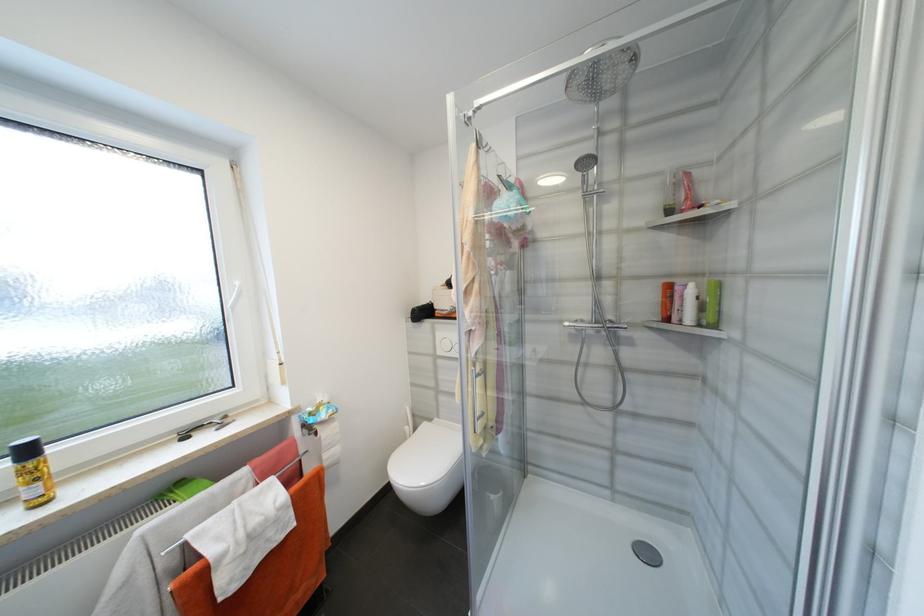
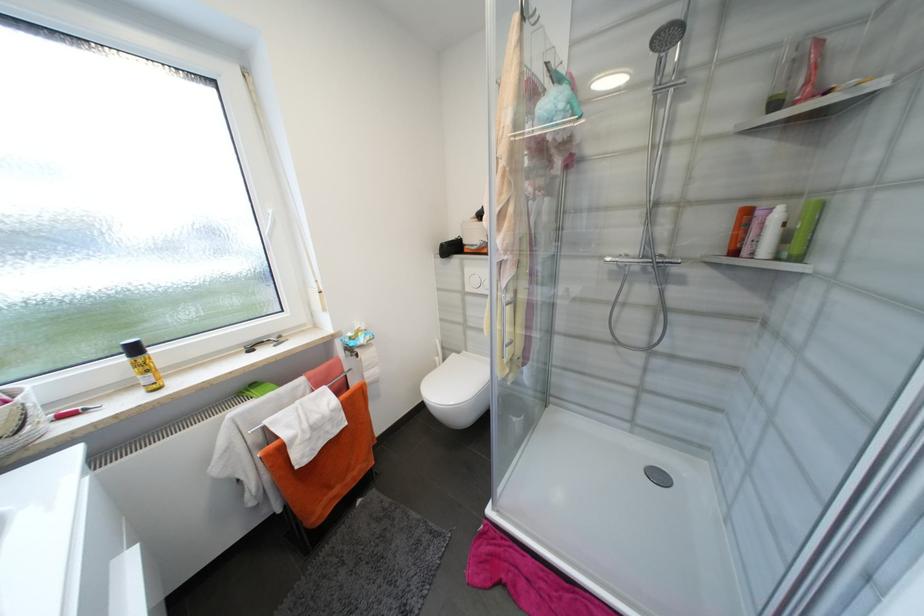
Question: Based on the continuous images, in which direction is the camera rotating? Reply with the corresponding letter.

Choices:
 (A) Left
 (B) Right
 (C) Up
 (D) Down

Answer: (D)